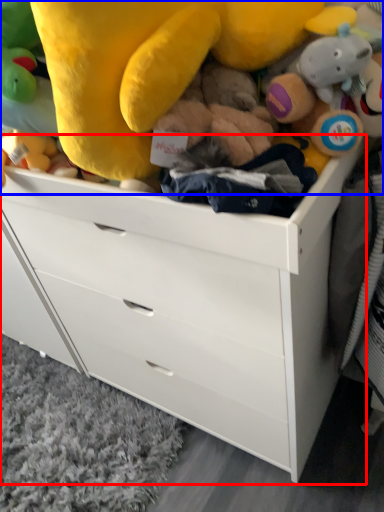
Question: Which object is closer to the camera taking this photo, chest of drawers (highlighted by a red box) or toy (highlighted by a blue box)?

Choices:
 (A) chest of drawers
 (B) toy

Answer: (B)